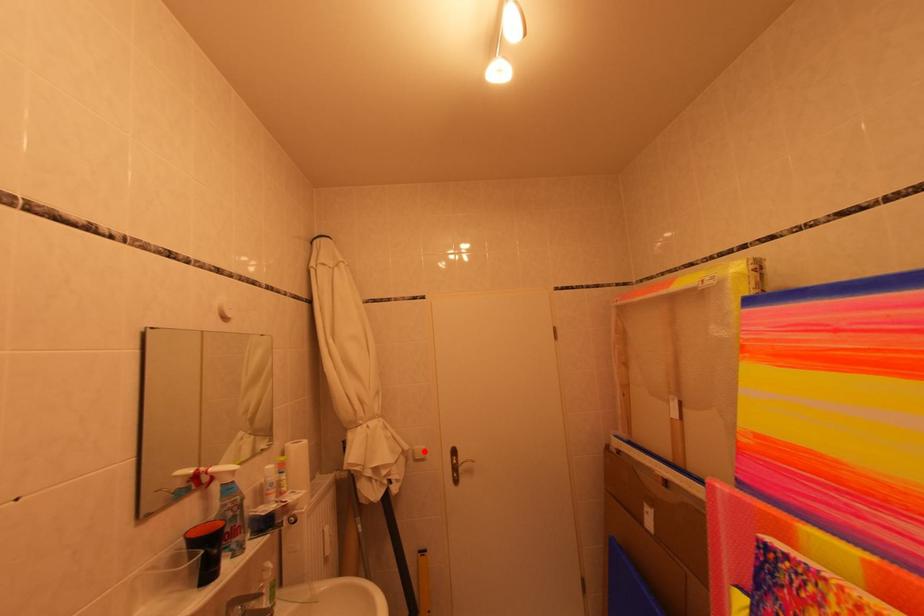
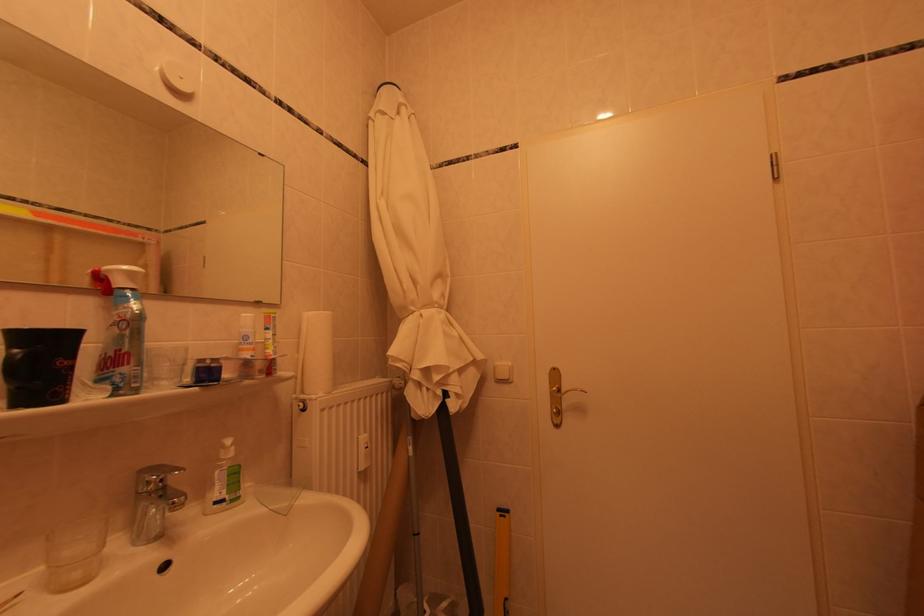
Locate, in the second image, the point that corresponds to the highlighted location in the first image.

(506, 367)